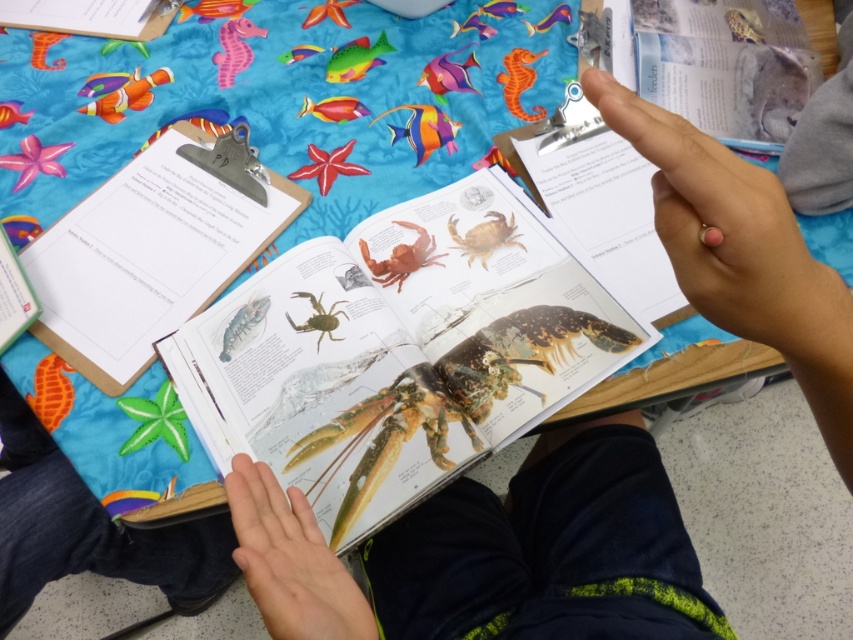
You are a student trying to reach the shiny paper book at center and the metallic clip at upper center. Which object can you grab first without moving your hand from its current position?

The shiny paper book at center is closer to the viewer than the metallic clip at upper center, so you can grab the shiny paper book at center first without moving your hand.

You are organizing a school project display and need to stack the shiny paper book at center and the matte paper clipboard at upper left vertically. Which object should you place at the bottom to ensure stability?

The shiny paper book at center should be placed at the bottom because it has a greater height than the matte paper clipboard at upper left, providing a more stable base.